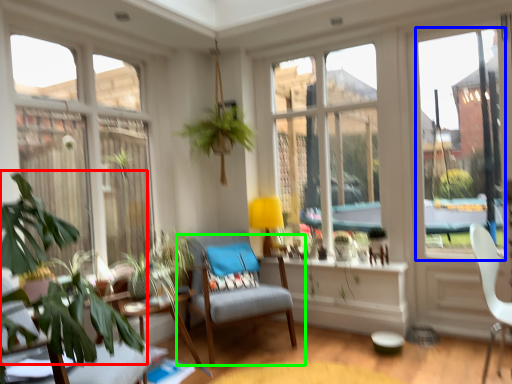
Question: Based on their relative distances, which object is farther from plant (highlighted by a red box)? Choose from window screen (highlighted by a blue box) and chair (highlighted by a green box).

Choices:
 (A) window screen
 (B) chair

Answer: (A)